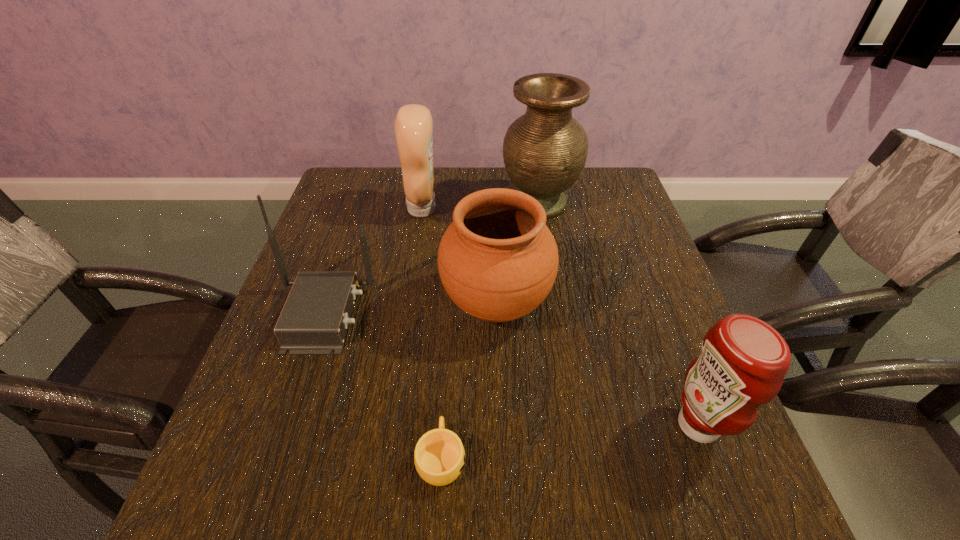
Where is `free spot that satisfies the following two spatial constraints: 1. on the back of the leftmost object to connect cables; 2. on the back side of the right condiment`? The width and height of the screenshot is (960, 540). free spot that satisfies the following two spatial constraints: 1. on the back of the leftmost object to connect cables; 2. on the back side of the right condiment is located at coordinates (286, 425).

Where is `free location that satisfies the following two spatial constraints: 1. on the front side of the pottery; 2. on the back of the leftmost object to connect cables`? This screenshot has width=960, height=540. free location that satisfies the following two spatial constraints: 1. on the front side of the pottery; 2. on the back of the leftmost object to connect cables is located at coordinates (496, 314).

Where is `free space that satisfies the following two spatial constraints: 1. on the label of the pottery; 2. on the left side of the farther condiment`? The image size is (960, 540). free space that satisfies the following two spatial constraints: 1. on the label of the pottery; 2. on the left side of the farther condiment is located at coordinates (407, 304).

What are the coordinates of `vacant area that satisfies the following two spatial constraints: 1. on the back of the router to connect cables; 2. on the right side of the right condiment` in the screenshot? It's located at (286, 425).